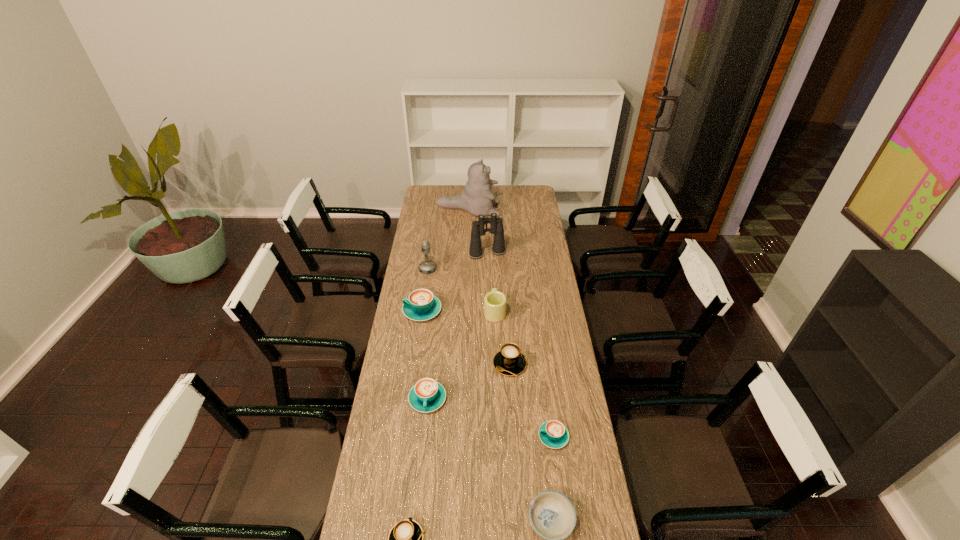
Locate an element on the screen. the fifth nearest object is located at coordinates (509, 361).

At what (x,y) coordinates should I click in order to perform the action: click on the fourth cappuccino from left to right. Please return your answer as a coordinate pair (x, y). The width and height of the screenshot is (960, 540). Looking at the image, I should click on (509, 361).

You are a GUI agent. You are given a task and a screenshot of the screen. Output one action in this format:
    pyautogui.click(x=<x>, y=<y>)
    Task: Click on the second nearest turquoise cappuccino
    Image resolution: width=960 pixels, height=540 pixels.
    Given the screenshot: What is the action you would take?
    pyautogui.click(x=427, y=395)

Locate an element on the screen. The image size is (960, 540). the third farthest cappuccino is located at coordinates (427, 395).

The height and width of the screenshot is (540, 960). I want to click on the rightmost turquoise cappuccino, so click(x=553, y=434).

Image resolution: width=960 pixels, height=540 pixels. Find the location of `the rightmost cappuccino`. the rightmost cappuccino is located at coordinates (553, 434).

Image resolution: width=960 pixels, height=540 pixels. I want to click on vacant space located 0.260m on the face of the tallest object, so click(542, 210).

Image resolution: width=960 pixels, height=540 pixels. I want to click on free space located on the left of the binoculars, so click(443, 253).

Where is `vacant space located on the front-facing side of the eighth nearest object`? The width and height of the screenshot is (960, 540). vacant space located on the front-facing side of the eighth nearest object is located at coordinates (446, 269).

Locate an element on the screen. The width and height of the screenshot is (960, 540). free location located with the handle on the side of the fourth tallest object is located at coordinates (493, 272).